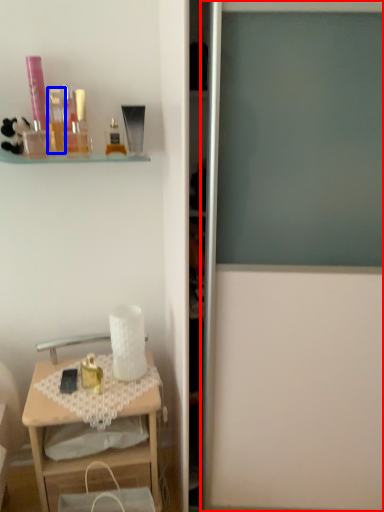
Question: Among these objects, which one is nearest to the camera, screen door (highlighted by a red box) or toiletry (highlighted by a blue box)?

Choices:
 (A) screen door
 (B) toiletry

Answer: (A)